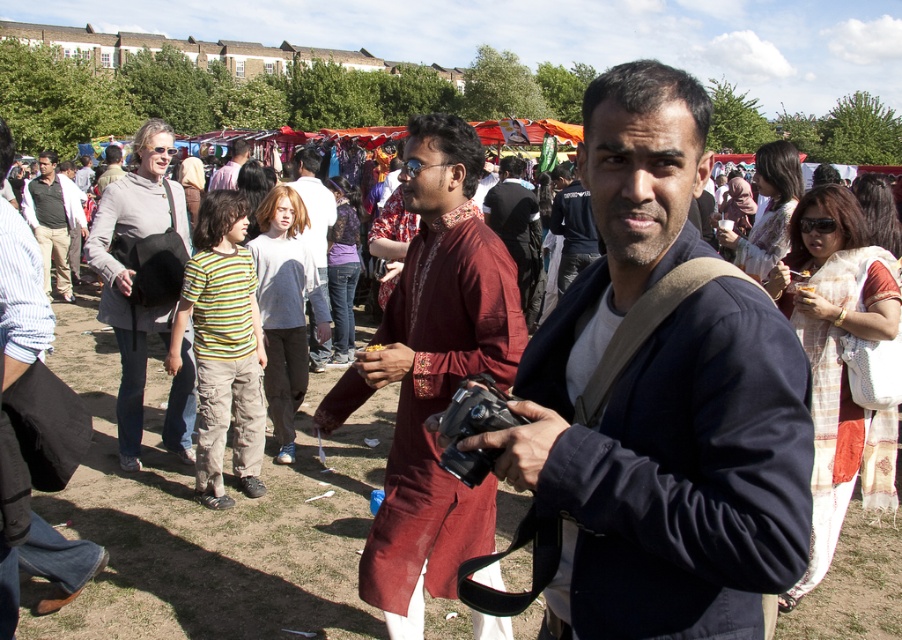
Can you confirm if dark blue jacket at center is wider than maroon fabric kurta at center?

In fact, dark blue jacket at center might be narrower than maroon fabric kurta at center.

Can you confirm if dark blue jacket at center is taller than maroon fabric kurta at center?

No, dark blue jacket at center is not taller than maroon fabric kurta at center.

The height and width of the screenshot is (640, 902). Find the location of `dark blue jacket at center`. dark blue jacket at center is located at coordinates (659, 397).

Between dark blue jacket at center and black plastic camera at center, which one is positioned higher?

dark blue jacket at center is above.

From the picture: Does dark blue jacket at center appear on the left side of black plastic camera at center?

No, dark blue jacket at center is not to the left of black plastic camera at center.

The image size is (902, 640). Describe the element at coordinates (659, 397) in the screenshot. I see `dark blue jacket at center` at that location.

At what (x,y) coordinates should I click in order to perform the action: click on dark blue jacket at center. Please return your answer as a coordinate pair (x, y). The height and width of the screenshot is (640, 902). Looking at the image, I should click on (659, 397).

Is point (456, 461) behind point (44, 176)?

No, (456, 461) is closer to viewer.

Is black plastic camera at center smaller than matte black jacket at left?

Yes.

Who is more distant from viewer, (x=503, y=394) or (x=25, y=216)?

The point (x=25, y=216) is more distant.

Where is `black plastic camera at center`? black plastic camera at center is located at coordinates (474, 426).